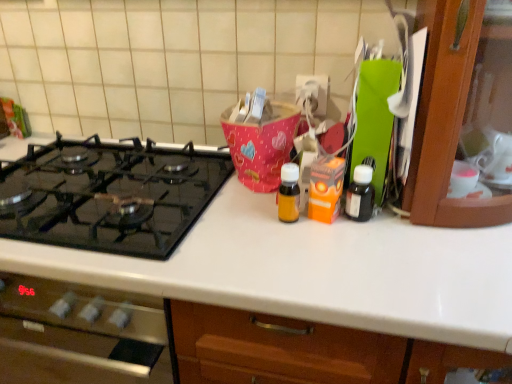
From the picture: Measure the distance between point (287, 195) and camera.

Point (287, 195) is 32.60 inches away from camera.

This screenshot has height=384, width=512. What do you see at coordinates (289, 194) in the screenshot?
I see `translucent amber bottle at center, the second bottle positioned from the right` at bounding box center [289, 194].

The image size is (512, 384). I want to click on black matte bottle at right, which ranks as the first bottle in right-to-left order, so click(360, 195).

Which is more to the left, translucent amber bottle at center, the second bottle positioned from the right, or black matte bottle at right, which is the second bottle from left to right?

translucent amber bottle at center, the second bottle positioned from the right.

Who is bigger, translucent amber bottle at center, the second bottle positioned from the right, or black matte bottle at right, which is the second bottle from left to right?

Bigger between the two is black matte bottle at right, which is the second bottle from left to right.

Based on the photo, from a real-world perspective, is translucent amber bottle at center, the second bottle positioned from the right, on black matte bottle at right, which is the second bottle from left to right?

Correct, in the physical world, translucent amber bottle at center, the second bottle positioned from the right, is higher than black matte bottle at right, which is the second bottle from left to right.

Does point (293, 201) appear closer or farther from the camera than point (362, 198)?

Point (293, 201) is positioned closer to the camera compared to point (362, 198).

How many degrees apart are the facing directions of black matte bottle at right, which ranks as the first bottle in right-to-left order, and translucent amber bottle at center, the second bottle positioned from the right?

0.00115 degrees.

Which of these two, black matte bottle at right, which ranks as the first bottle in right-to-left order, or translucent amber bottle at center, the second bottle positioned from the right, stands taller?

Standing taller between the two is black matte bottle at right, which ranks as the first bottle in right-to-left order.

Considering the positions of objects black matte bottle at right, which is the second bottle from left to right, and translucent amber bottle at center, the second bottle positioned from the right, in the image provided, who is behind, black matte bottle at right, which is the second bottle from left to right, or translucent amber bottle at center, the second bottle positioned from the right,?

black matte bottle at right, which is the second bottle from left to right, is further away from the camera.

Is translucent amber bottle at center, acting as the 1th bottle starting from the left, at the back of black matte bottle at right, which ranks as the first bottle in right-to-left order?

No, black matte bottle at right, which ranks as the first bottle in right-to-left order,'s orientation is not away from translucent amber bottle at center, acting as the 1th bottle starting from the left.

Can you confirm if black glass gas stove at left is bigger than black matte bottle at right, which ranks as the first bottle in right-to-left order?

Indeed, black glass gas stove at left has a larger size compared to black matte bottle at right, which ranks as the first bottle in right-to-left order.

From the image's perspective, does black glass gas stove at left appear higher than black matte bottle at right, which ranks as the first bottle in right-to-left order?

Correct, black glass gas stove at left appears higher than black matte bottle at right, which ranks as the first bottle in right-to-left order, in the image.

Which is less distant, (126, 184) or (354, 194)?

Point (354, 194)

Is black glass gas stove at left thinner than black matte bottle at right, which is the second bottle from left to right?

In fact, black glass gas stove at left might be wider than black matte bottle at right, which is the second bottle from left to right.

In the scene shown: Which is more to the left, black glass gas stove at left or translucent amber bottle at center, acting as the 1th bottle starting from the left?

black glass gas stove at left is more to the left.

Find the location of a particular element. This screenshot has width=512, height=384. gas stove on the left of the translucent amber bottle at center, acting as the 1th bottle starting from the left is located at coordinates (109, 196).

Between black glass gas stove at left and translucent amber bottle at center, acting as the 1th bottle starting from the left, which one has less height?

Standing shorter between the two is black glass gas stove at left.

Does point (369, 190) come closer to viewer compared to point (36, 194)?

Yes.

Looking at this image, is black matte bottle at right, which ranks as the first bottle in right-to-left order, with black glass gas stove at left?

No, black matte bottle at right, which ranks as the first bottle in right-to-left order, is not with black glass gas stove at left.

Identify the location of gas stove that appears in front of the black matte bottle at right, which ranks as the first bottle in right-to-left order. The width and height of the screenshot is (512, 384). (109, 196).

Who is bigger, black matte bottle at right, which ranks as the first bottle in right-to-left order, or black glass gas stove at left?

black glass gas stove at left is bigger.

Considering the relative positions of translucent amber bottle at center, the second bottle positioned from the right, and black glass gas stove at left in the image provided, is translucent amber bottle at center, the second bottle positioned from the right, to the right of black glass gas stove at left from the viewer's perspective?

Yes.

In the scene shown: Which is farther, [290,171] or [50,169]?

The point [50,169] is more distant.

In the scene shown: Is translucent amber bottle at center, the second bottle positioned from the right, not inside black glass gas stove at left?

translucent amber bottle at center, the second bottle positioned from the right, lies outside black glass gas stove at left's area.

In the image, there is a translucent amber bottle at center, acting as the 1th bottle starting from the left. Where is `bottle below it (from a real-world perspective)`? This screenshot has width=512, height=384. bottle below it (from a real-world perspective) is located at coordinates click(x=360, y=195).

This screenshot has width=512, height=384. I want to click on bottle that is in front of the black matte bottle at right, which is the second bottle from left to right, so tap(289, 194).

Estimate the real-world distances between objects in this image. Which object is further from black matte bottle at right, which ranks as the first bottle in right-to-left order, translucent amber bottle at center, acting as the 1th bottle starting from the left, or black glass gas stove at left?

The object further to black matte bottle at right, which ranks as the first bottle in right-to-left order, is black glass gas stove at left.

From the image, which object appears to be farther from black glass gas stove at left, translucent amber bottle at center, the second bottle positioned from the right, or black matte bottle at right, which is the second bottle from left to right?

black matte bottle at right, which is the second bottle from left to right, lies further to black glass gas stove at left than the other object.

From the image, which object appears to be nearer to black glass gas stove at left, black matte bottle at right, which is the second bottle from left to right, or translucent amber bottle at center, acting as the 1th bottle starting from the left?

The object closer to black glass gas stove at left is translucent amber bottle at center, acting as the 1th bottle starting from the left.

Estimate the real-world distances between objects in this image. Which object is closer to black matte bottle at right, which ranks as the first bottle in right-to-left order, black glass gas stove at left or translucent amber bottle at center, the second bottle positioned from the right?

Among the two, translucent amber bottle at center, the second bottle positioned from the right, is located nearer to black matte bottle at right, which ranks as the first bottle in right-to-left order.

From the image, which object appears to be farther from translucent amber bottle at center, the second bottle positioned from the right, black glass gas stove at left or black matte bottle at right, which ranks as the first bottle in right-to-left order?

black glass gas stove at left is further to translucent amber bottle at center, the second bottle positioned from the right.

Considering their positions, is black matte bottle at right, which is the second bottle from left to right, positioned further to translucent amber bottle at center, acting as the 1th bottle starting from the left, than black glass gas stove at left?

black glass gas stove at left lies further to translucent amber bottle at center, acting as the 1th bottle starting from the left, than the other object.

Locate an element on the screen. bottle between black glass gas stove at left and black matte bottle at right, which is the second bottle from left to right, in the horizontal direction is located at coordinates (289, 194).